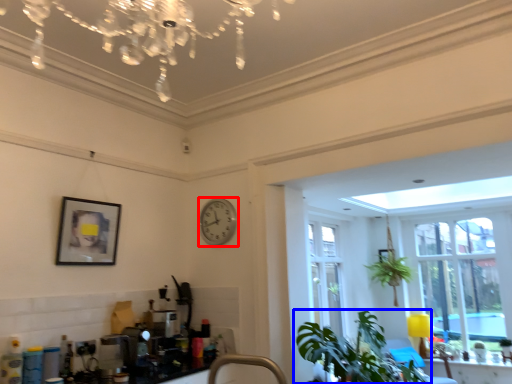
Question: Which object appears closest to the camera in this image, clock (highlighted by a red box) or houseplant (highlighted by a blue box)?

Choices:
 (A) clock
 (B) houseplant

Answer: (B)